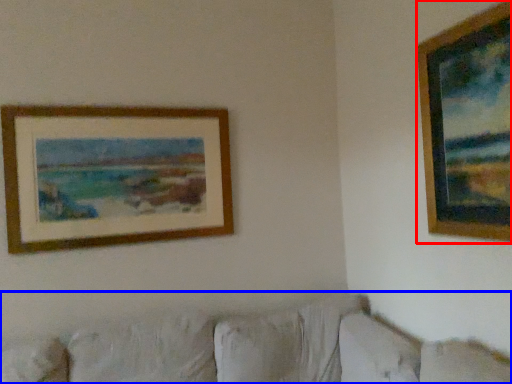
Question: Which point is closer to the camera, picture frame (highlighted by a red box) or couch (highlighted by a blue box)?

Choices:
 (A) picture frame
 (B) couch

Answer: (B)